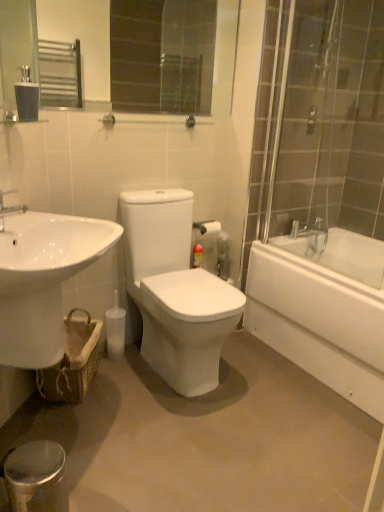
Question: Do you think silver metallic faucet at upper left is within glossy glass mirror at upper center, or outside of it?

Choices:
 (A) outside
 (B) inside

Answer: (A)

Question: From the image's perspective, is silver metallic faucet at upper left located above or below glossy glass mirror at upper center?

Choices:
 (A) below
 (B) above

Answer: (A)

Question: Which is nearer to the glossy glass mirror at upper center?

Choices:
 (A) transparent glass shower door at right
 (B) white glossy sink at lower left
 (C) silver metallic faucet at upper left
 (D) white glossy bathtub at right
 (E) matte black tissue at upper left

Answer: (A)

Question: Which is nearer to the white glossy bathtub at right?

Choices:
 (A) silver metallic faucet at upper left
 (B) transparent glass shower door at right
 (C) matte black tissue at upper left
 (D) glossy glass mirror at upper center
 (E) white glossy sink at lower left

Answer: (B)